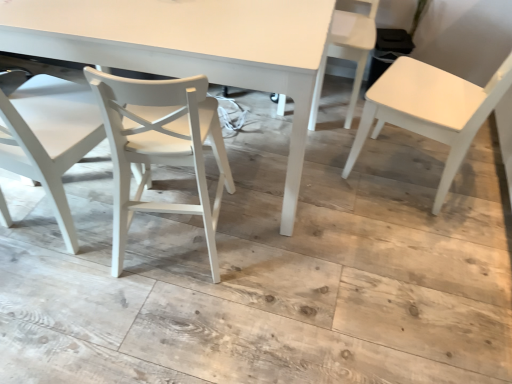
What are the coordinates of `spots to the right of white matte chair at center, marked as the second chair in a left-to-right arrangement` in the screenshot? It's located at (279, 238).